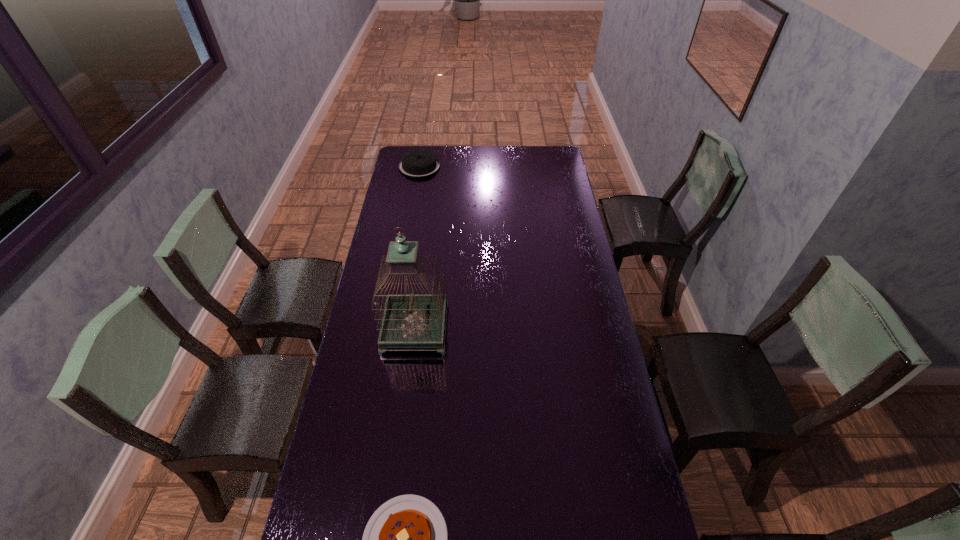
This screenshot has width=960, height=540. Find the location of `free space at the far edge`. free space at the far edge is located at coordinates (468, 159).

In the image, there is a desktop. Where is `vacant space at the left edge`? vacant space at the left edge is located at coordinates (414, 204).

This screenshot has width=960, height=540. Identify the location of vacant area at the right edge. (612, 505).

Identify the location of vacant region at the far right corner of the desktop. This screenshot has width=960, height=540. (542, 169).

At what (x,y) coordinates should I click in order to perform the action: click on object that is the second nearest to the second farthest object. Please return your answer as a coordinate pair (x, y). This screenshot has height=540, width=960. Looking at the image, I should click on (418, 163).

Find the location of a particular element. object that is the closest one to the tallest object is located at coordinates (406, 539).